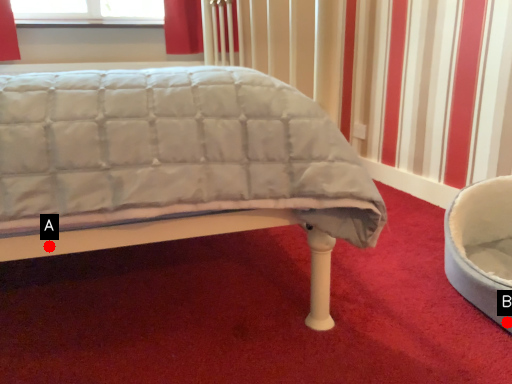
Question: Two points are circled on the image, labeled by A and B beside each circle. Which point is closer to the camera taking this photo?

Choices:
 (A) A is closer
 (B) B is closer

Answer: (A)